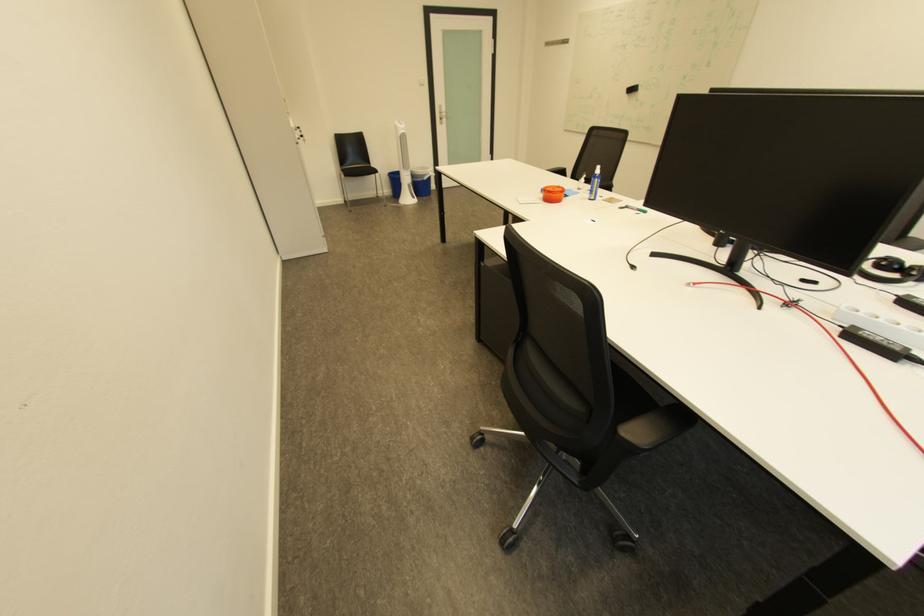
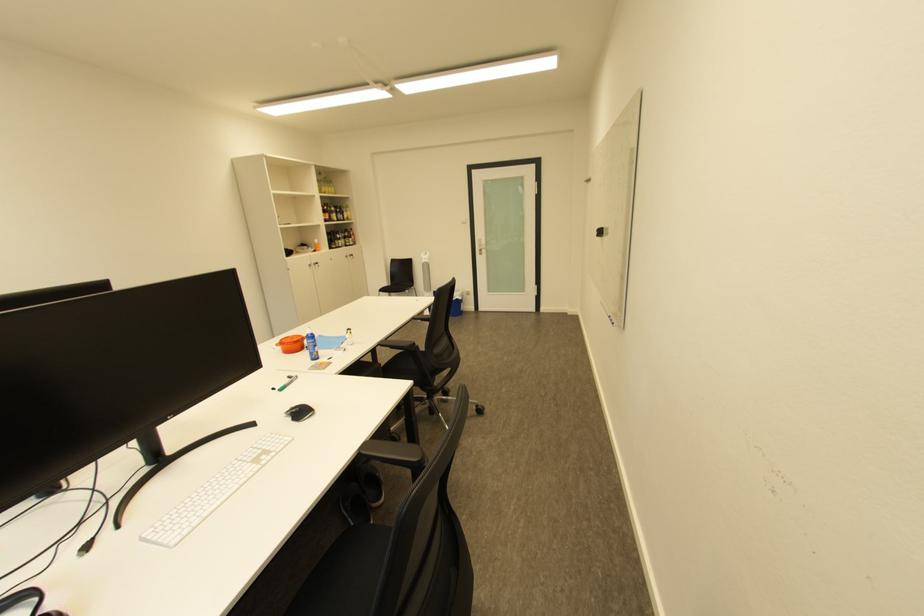
In the second image, find the point that corresponds to [313,142] in the first image.

(329, 267)